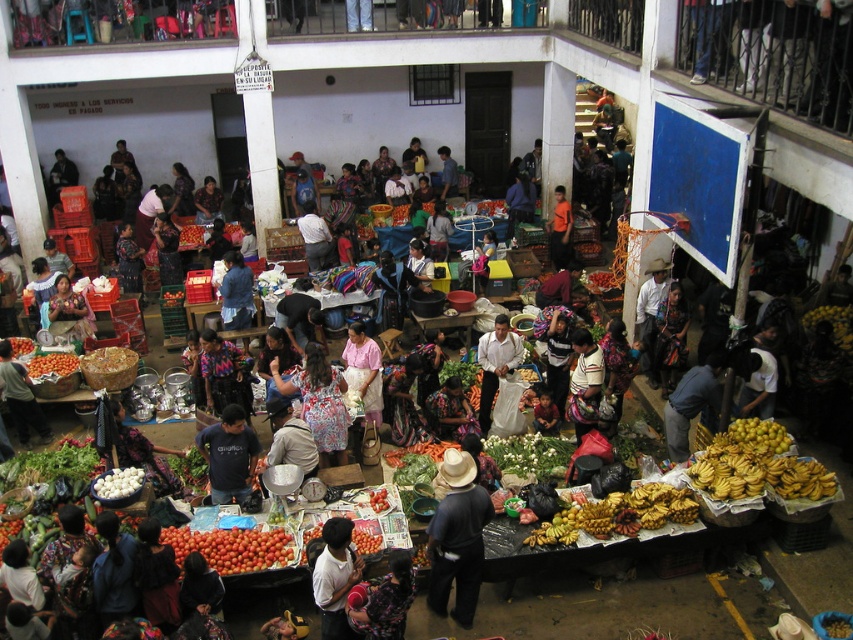
You are a customer at the market and want to place a basket of ripe red tomatoes at lower center onto the white woven fabric at center. Will the tomatoes fit on the fabric without hanging over the edges?

The ripe red tomatoes at lower center is shorter than white woven fabric at center, so the tomatoes will fit on the fabric without hanging over the edges.

You are a vendor at the market and need to display a new batch of oranges. You have two options for placement on your stall. The first option is next to the dark blue fabric at center, and the second is next to the orange matte tomatoes at center. Which location will allow the oranges to be more visible to customers passing by?

The dark blue fabric at center is much taller than the orange matte tomatoes at center, so placing the oranges next to the dark blue fabric at center will make them more visible as the height difference will draw attention.